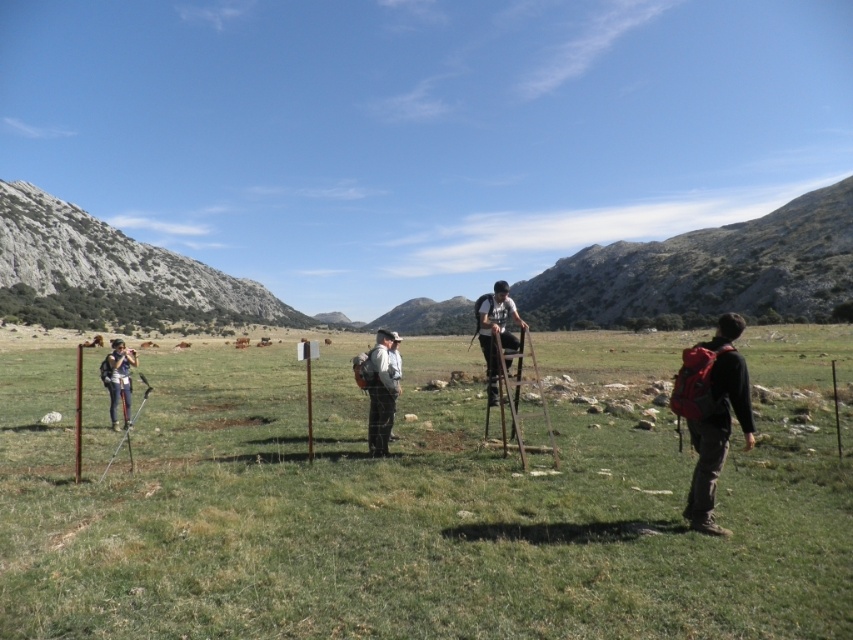
Is camouflage fabric backpack at center below white fabric shirt at center?

Indeed, camouflage fabric backpack at center is positioned under white fabric shirt at center.

Locate an element on the screen. This screenshot has width=853, height=640. camouflage fabric backpack at center is located at coordinates (378, 390).

Is the position of red backpack at right less distant than that of matte black backpack at left?

Yes, it is.

In the scene shown: Can you confirm if red backpack at right is bigger than matte black backpack at left?

Correct, red backpack at right is larger in size than matte black backpack at left.

Describe the element at coordinates (711, 412) in the screenshot. I see `red backpack at right` at that location.

You are a GUI agent. You are given a task and a screenshot of the screen. Output one action in this format:
    pyautogui.click(x=<x>, y=<y>)
    Task: Click on the red backpack at right
    Image resolution: width=853 pixels, height=640 pixels.
    Given the screenshot: What is the action you would take?
    pyautogui.click(x=711, y=412)

What do you see at coordinates (409, 508) in the screenshot? The image size is (853, 640). I see `green grassy field at center` at bounding box center [409, 508].

Who is more distant from viewer, (669, 339) or (717, 422)?

The point (669, 339) is more distant.

Where is `green grassy field at center`? The width and height of the screenshot is (853, 640). green grassy field at center is located at coordinates (x=409, y=508).

Locate an element on the screen. green grassy field at center is located at coordinates (409, 508).